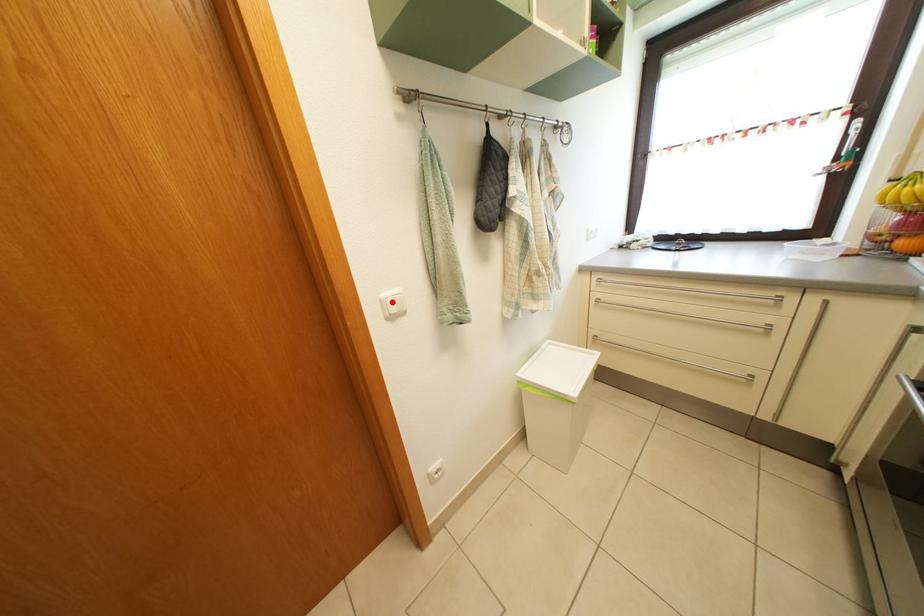
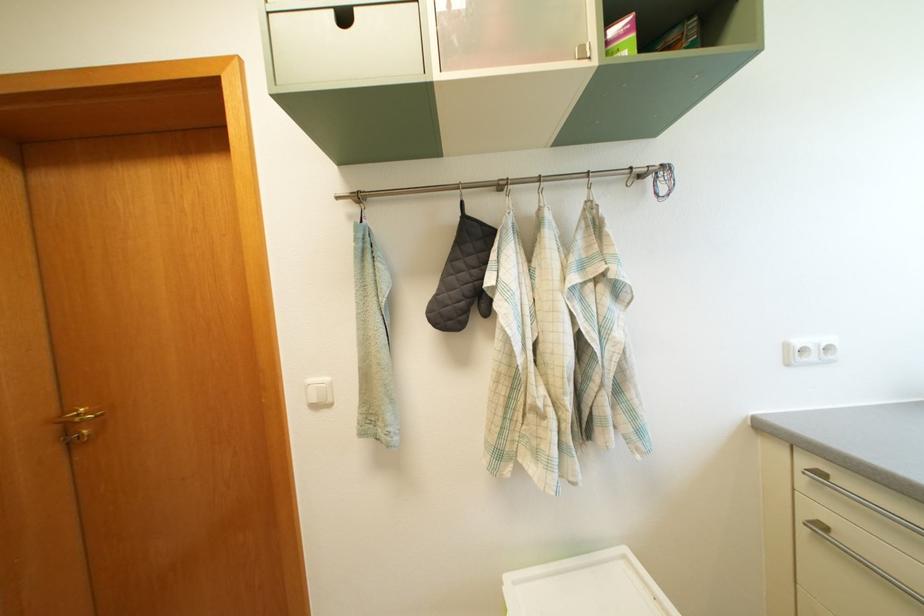
Find the pixel in the second image that matches the highlighted location in the first image.

(318, 387)